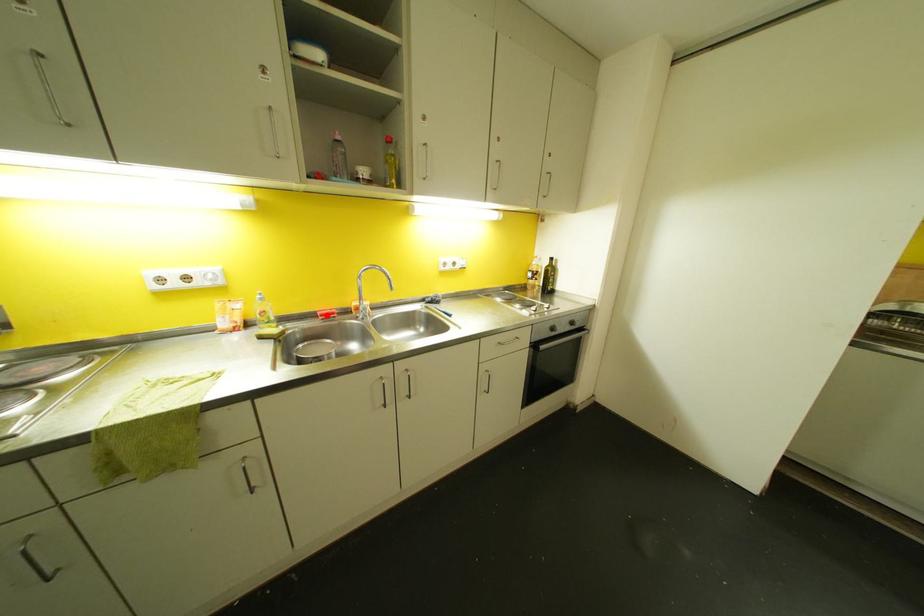
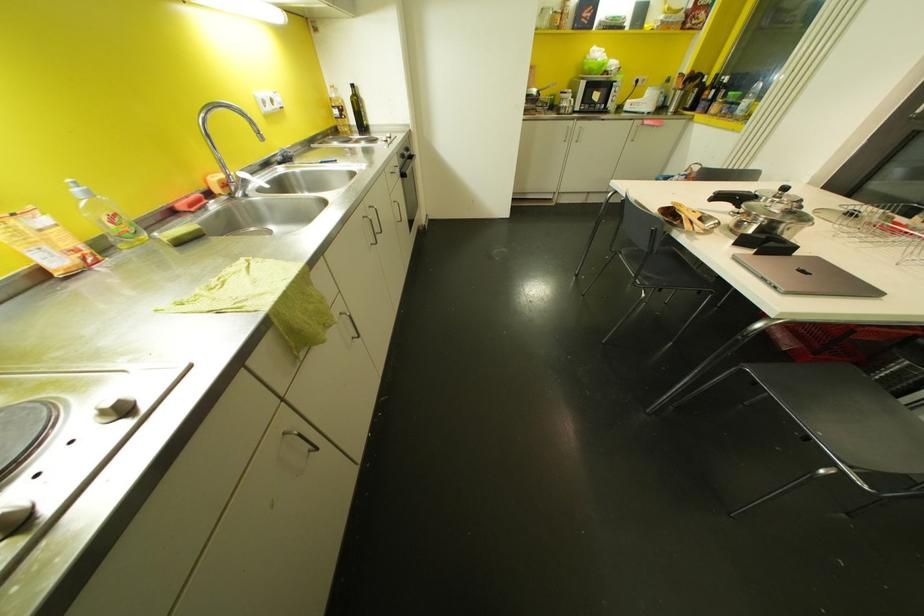
Where in the second image is the point corresponding to the highlighted location from the first image?

(198, 204)